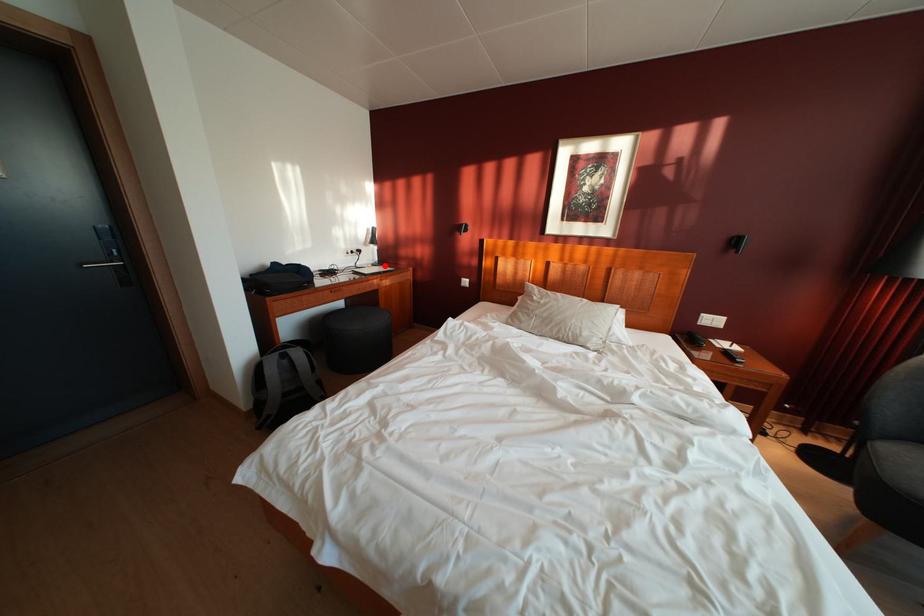
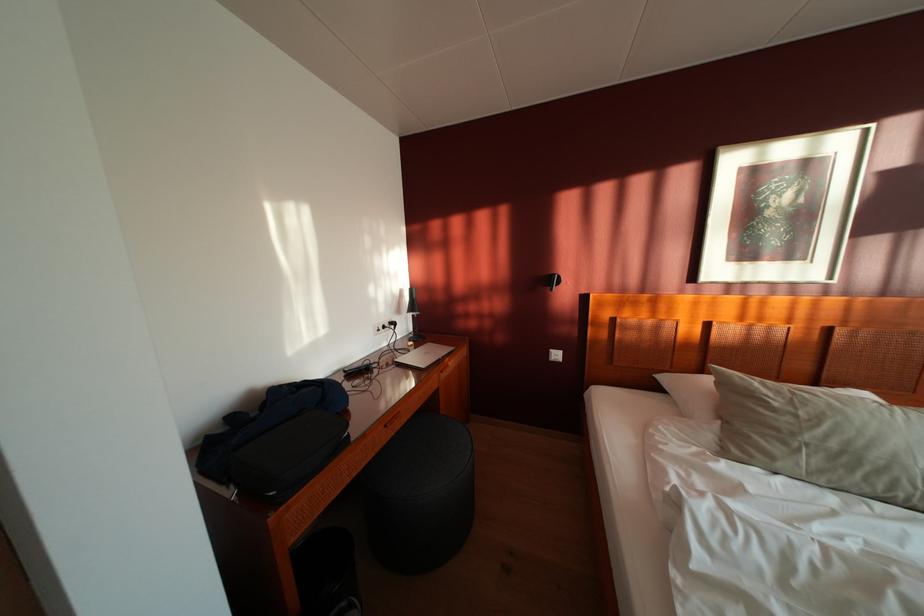
Question: I am providing you with two images of the same scene from different viewpoints. A red point is shown in image1. For the corresponding object point in image2, is it positioned nearer or farther from the camera?

Choices:
 (A) Nearer
 (B) Farther

Answer: (B)